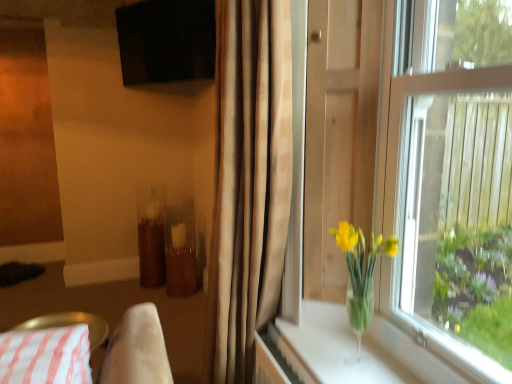
Locate an element on the screen. vacant space to the left of translucent glass vase at window is located at coordinates (312, 358).